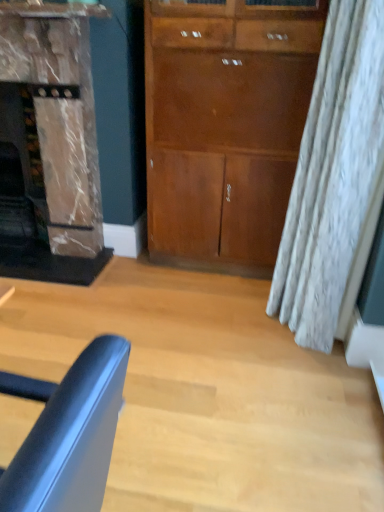
Question: Considering the relative sizes of matte brown fireplace at left and matte wood cabinet at center in the image provided, is matte brown fireplace at left shorter than matte wood cabinet at center?

Choices:
 (A) yes
 (B) no

Answer: (A)

Question: Is matte brown fireplace at left in front of matte wood cabinet at center?

Choices:
 (A) no
 (B) yes

Answer: (A)

Question: From a real-world perspective, does matte brown fireplace at left sit lower than matte wood cabinet at center?

Choices:
 (A) no
 (B) yes

Answer: (B)

Question: Can matte wood cabinet at center be found inside matte brown fireplace at left?

Choices:
 (A) no
 (B) yes

Answer: (A)

Question: Can you confirm if matte brown fireplace at left is positioned to the right of matte wood cabinet at center?

Choices:
 (A) yes
 (B) no

Answer: (B)

Question: Can you confirm if matte brown fireplace at left is smaller than matte wood cabinet at center?

Choices:
 (A) no
 (B) yes

Answer: (A)

Question: Considering the relative sizes of matte blue chair at lower left and matte wood cabinet at center in the image provided, is matte blue chair at lower left shorter than matte wood cabinet at center?

Choices:
 (A) yes
 (B) no

Answer: (A)

Question: Does matte blue chair at lower left lie in front of matte wood cabinet at center?

Choices:
 (A) no
 (B) yes

Answer: (B)

Question: Are matte blue chair at lower left and matte wood cabinet at center beside each other?

Choices:
 (A) yes
 (B) no

Answer: (B)

Question: Is matte blue chair at lower left outside matte wood cabinet at center?

Choices:
 (A) yes
 (B) no

Answer: (A)

Question: Is matte blue chair at lower left at the right side of matte wood cabinet at center?

Choices:
 (A) yes
 (B) no

Answer: (B)

Question: From a real-world perspective, is matte blue chair at lower left below matte wood cabinet at center?

Choices:
 (A) yes
 (B) no

Answer: (A)

Question: Can you confirm if matte wood cabinet at center is taller than matte brown fireplace at left?

Choices:
 (A) no
 (B) yes

Answer: (B)